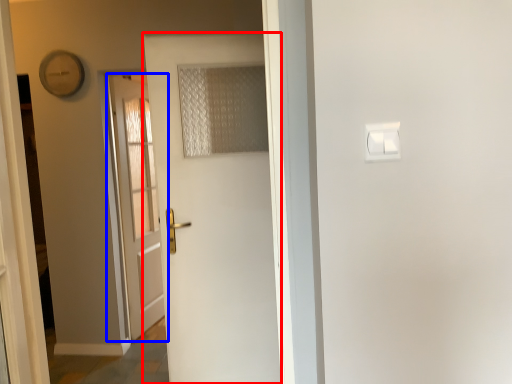
Question: Which object appears closest to the camera in this image, door (highlighted by a red box) or door (highlighted by a blue box)?

Choices:
 (A) door
 (B) door

Answer: (A)